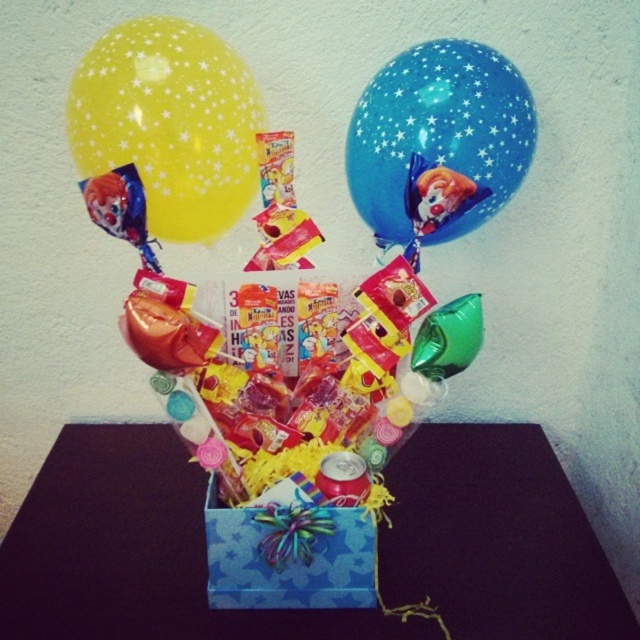
Question: Can you confirm if blue cardboard box at center is wider than metallic clown balloon at upper left?

Choices:
 (A) yes
 (B) no

Answer: (A)

Question: Based on their relative distances, which object is farther from the blue paper gift box at center?

Choices:
 (A) yellow star-patterned balloon at upper left
 (B) metallic clown balloon at upper left
 (C) blue cardboard box at center

Answer: (A)

Question: Is blue cardboard box at center below blue star-patterned balloon at upper center?

Choices:
 (A) no
 (B) yes

Answer: (B)

Question: Among these points, which one is farthest from the camera?

Choices:
 (A) (220, 572)
 (B) (100, 180)
 (C) (497, 465)

Answer: (C)

Question: Which point is farther to the camera?

Choices:
 (A) (548, 557)
 (B) (140, 244)
 (C) (339, 520)
 (D) (154, 76)

Answer: (A)

Question: Does blue star-patterned balloon at upper center have a smaller size compared to metallic clown balloon at upper left?

Choices:
 (A) yes
 (B) no

Answer: (B)